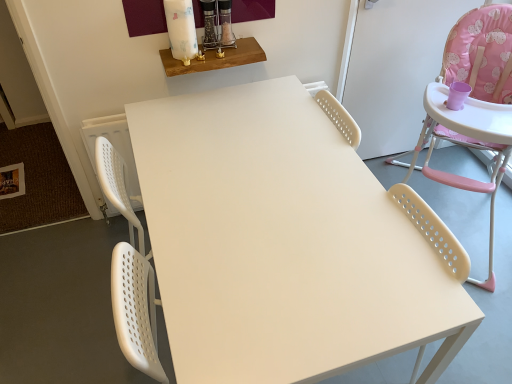
I want to click on pink fabric highchair at right, so (x=481, y=56).

Is matte white table at center, marked as the first table in a right-to-left arrangement, situated inside wooden shelf at upper center, arranged as the second table when ordered from the bottom, or outside?

matte white table at center, marked as the first table in a right-to-left arrangement, is spatially situated outside wooden shelf at upper center, arranged as the second table when ordered from the bottom.

From the image's perspective, is matte white table at center, which ranks as the first table in front-to-back order, above or below wooden shelf at upper center, positioned as the 2th table in front-to-back order?

Based on their image positions, matte white table at center, which ranks as the first table in front-to-back order, is located beneath wooden shelf at upper center, positioned as the 2th table in front-to-back order.

Locate an element on the screen. This screenshot has width=512, height=384. table below the wooden shelf at upper center, positioned as the 2th table in front-to-back order (from the image's perspective) is located at coordinates (278, 240).

Considering the sizes of objects matte white table at center, marked as the first table in a right-to-left arrangement, and wooden shelf at upper center, arranged as the first table when viewed from the back, in the image provided, who is shorter, matte white table at center, marked as the first table in a right-to-left arrangement, or wooden shelf at upper center, arranged as the first table when viewed from the back,?

Standing shorter between the two is wooden shelf at upper center, arranged as the first table when viewed from the back.

Consider the image. Does wooden shelf at upper center, which is counted as the 1th table, starting from the top, have a smaller size compared to matte white table at center, marked as the first table in a right-to-left arrangement?

Yes, wooden shelf at upper center, which is counted as the 1th table, starting from the top, is smaller than matte white table at center, marked as the first table in a right-to-left arrangement.

Considering the relative positions of wooden shelf at upper center, arranged as the second table when ordered from the bottom, and matte white table at center, marked as the first table in a right-to-left arrangement, in the image provided, is wooden shelf at upper center, arranged as the second table when ordered from the bottom, to the left of matte white table at center, marked as the first table in a right-to-left arrangement, from the viewer's perspective?

Yes.

Relative to matte white table at center, which is counted as the 1th table, starting from the bottom, is wooden shelf at upper center, positioned as the 2th table in front-to-back order, in front or behind?

wooden shelf at upper center, positioned as the 2th table in front-to-back order, is positioned farther from the viewer than matte white table at center, which is counted as the 1th table, starting from the bottom.

Between wooden shelf at upper center, which is the 2th table from right to left, and pink fabric highchair at right, which one appears on the left side from the viewer's perspective?

From the viewer's perspective, wooden shelf at upper center, which is the 2th table from right to left, appears more on the left side.

Looking at this image, from the image's perspective, is wooden shelf at upper center, arranged as the first table when viewed from the back, located beneath pink fabric highchair at right?

No, from the image's perspective, wooden shelf at upper center, arranged as the first table when viewed from the back, is not beneath pink fabric highchair at right.

Is wooden shelf at upper center, arranged as the first table when viewed from the back, not near pink fabric highchair at right?

No.

Can you confirm if pink fabric highchair at right is taller than wooden shelf at upper center, which is the 2th table from right to left?

Yes, pink fabric highchair at right is taller than wooden shelf at upper center, which is the 2th table from right to left.

Does point (492, 262) lie in front of point (206, 65)?

No, (492, 262) is further to viewer.

Does pink fabric highchair at right touch wooden shelf at upper center, arranged as the second table when ordered from the bottom?

No, pink fabric highchair at right is not next to wooden shelf at upper center, arranged as the second table when ordered from the bottom.

Does matte white table at center, which appears as the second table when viewed from the top, have a larger size compared to pink fabric highchair at right?

No.

In terms of height, does matte white table at center, which is counted as the second table, starting from the left, look taller or shorter compared to pink fabric highchair at right?

Considering their sizes, matte white table at center, which is counted as the second table, starting from the left, has less height than pink fabric highchair at right.

Is pink fabric highchair at right completely or partially inside matte white table at center, which is counted as the 1th table, starting from the bottom?

That's incorrect, pink fabric highchair at right is not inside matte white table at center, which is counted as the 1th table, starting from the bottom.

Between pink fabric highchair at right and matte white table at center, which is counted as the second table, starting from the left, which one appears on the right side from the viewer's perspective?

pink fabric highchair at right is more to the right.

In the scene shown: Is the position of pink fabric highchair at right more distant than that of matte white table at center, which ranks as the 2th table in back-to-front order?

Yes, pink fabric highchair at right is further from the viewer.

From the image's perspective, which one is positioned lower, pink fabric highchair at right or matte white table at center, which is counted as the second table, starting from the left?

matte white table at center, which is counted as the second table, starting from the left, appears lower in the image.

Is pink fabric highchair at right positioned beyond the bounds of matte white table at center, which appears as the second table when viewed from the top?

Indeed, pink fabric highchair at right is completely outside matte white table at center, which appears as the second table when viewed from the top.

The height and width of the screenshot is (384, 512). In order to click on table lying behind the matte white table at center, which appears as the second table when viewed from the top in this screenshot , I will do `click(216, 58)`.

Locate an element on the screen. This screenshot has width=512, height=384. table lying on the left of matte white table at center, which is counted as the 1th table, starting from the bottom is located at coordinates (216, 58).

When comparing their distances from pink fabric highchair at right, does wooden shelf at upper center, which is counted as the 1th table, starting from the top, or matte white table at center, which is counted as the second table, starting from the left, seem closer?

matte white table at center, which is counted as the second table, starting from the left, lies closer to pink fabric highchair at right than the other object.

Looking at the image, which one is located further to matte white table at center, which ranks as the 2th table in back-to-front order, pink fabric highchair at right or wooden shelf at upper center, the first table in the left-to-right sequence?

pink fabric highchair at right is positioned further to the anchor matte white table at center, which ranks as the 2th table in back-to-front order.

Estimate the real-world distances between objects in this image. Which object is further from wooden shelf at upper center, positioned as the 2th table in front-to-back order, matte white table at center, which is counted as the second table, starting from the left, or pink fabric highchair at right?

pink fabric highchair at right is further to wooden shelf at upper center, positioned as the 2th table in front-to-back order.

When comparing their distances from wooden shelf at upper center, arranged as the second table when ordered from the bottom, does pink fabric highchair at right or matte white table at center, which ranks as the 2th table in back-to-front order, seem closer?

matte white table at center, which ranks as the 2th table in back-to-front order.

Looking at the image, which one is located closer to pink fabric highchair at right, matte white table at center, which is counted as the second table, starting from the left, or wooden shelf at upper center, which is the 2th table from right to left?

matte white table at center, which is counted as the second table, starting from the left, lies closer to pink fabric highchair at right than the other object.

From the image, which object appears to be farther from matte white table at center, which ranks as the first table in front-to-back order, wooden shelf at upper center, arranged as the first table when viewed from the back, or pink fabric highchair at right?

pink fabric highchair at right.

What are the coordinates of `table between wooden shelf at upper center, which is counted as the 1th table, starting from the top, and pink fabric highchair at right` in the screenshot? It's located at (278, 240).